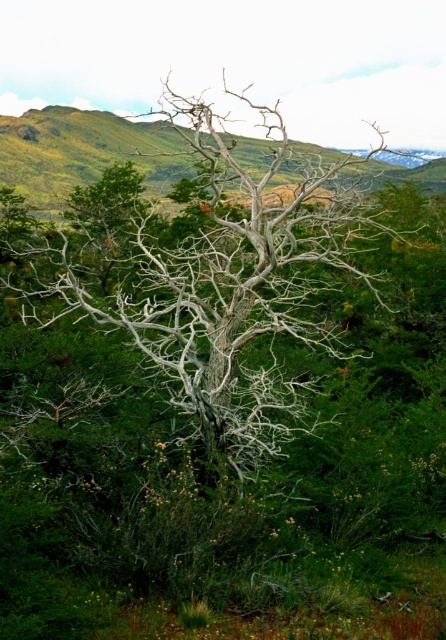
Which of these two, white bark tree at center or gray bark tree at center, stands taller?

white bark tree at center

You are a GUI agent. You are given a task and a screenshot of the screen. Output one action in this format:
    pyautogui.click(x=<x>, y=<y>)
    Task: Click on the white bark tree at center
    The width and height of the screenshot is (446, 640).
    Given the screenshot: What is the action you would take?
    pyautogui.click(x=222, y=278)

The image size is (446, 640). In order to click on white bark tree at center in this screenshot , I will do `click(222, 278)`.